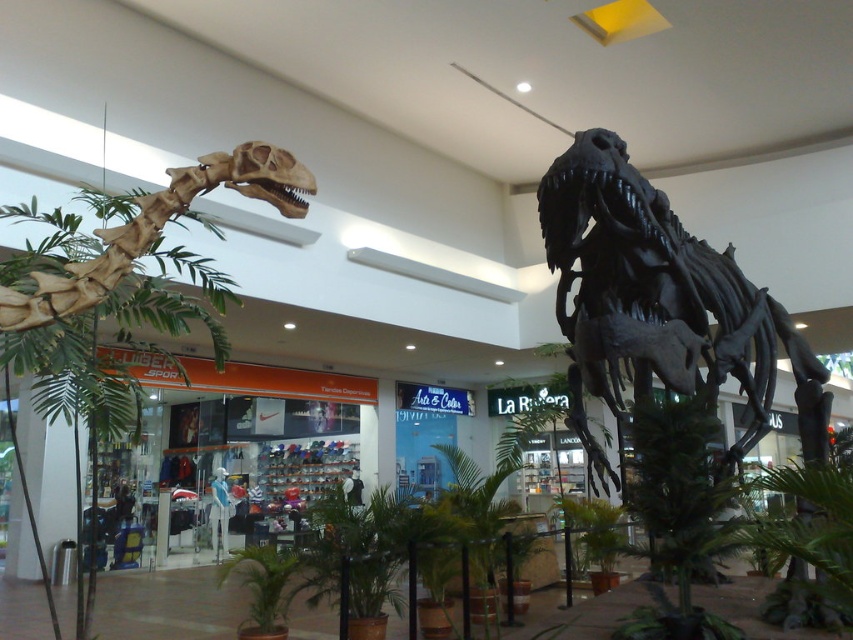
Which is in front, point (646, 209) or point (260, 627)?

Point (646, 209)

Which is below, black matte skeleton at center or green leafy plant at center?

green leafy plant at center is below.

This screenshot has width=853, height=640. What do you see at coordinates (660, 301) in the screenshot?
I see `black matte skeleton at center` at bounding box center [660, 301].

In order to click on black matte skeleton at center in this screenshot , I will do `click(660, 301)`.

Between green leafy palm tree at left and green leafy plant at center, which one appears on the left side from the viewer's perspective?

green leafy plant at center is more to the left.

Measure the distance between green leafy palm tree at left and camera.

A distance of 8.09 feet exists between green leafy palm tree at left and camera.

The height and width of the screenshot is (640, 853). Identify the location of green leafy palm tree at left. (158, 228).

Between point (602, 337) and point (210, 189), which one is positioned behind?

The point (602, 337) is behind.

This screenshot has width=853, height=640. What are the coordinates of `black matte skeleton at center` in the screenshot? It's located at (660, 301).

Between point (762, 378) and point (47, 291), which one is positioned behind?

Point (762, 378)

You are a GUI agent. You are given a task and a screenshot of the screen. Output one action in this format:
    pyautogui.click(x=<x>, y=<y>)
    Task: Click on the black matte skeleton at center
    
    Given the screenshot: What is the action you would take?
    pyautogui.click(x=660, y=301)